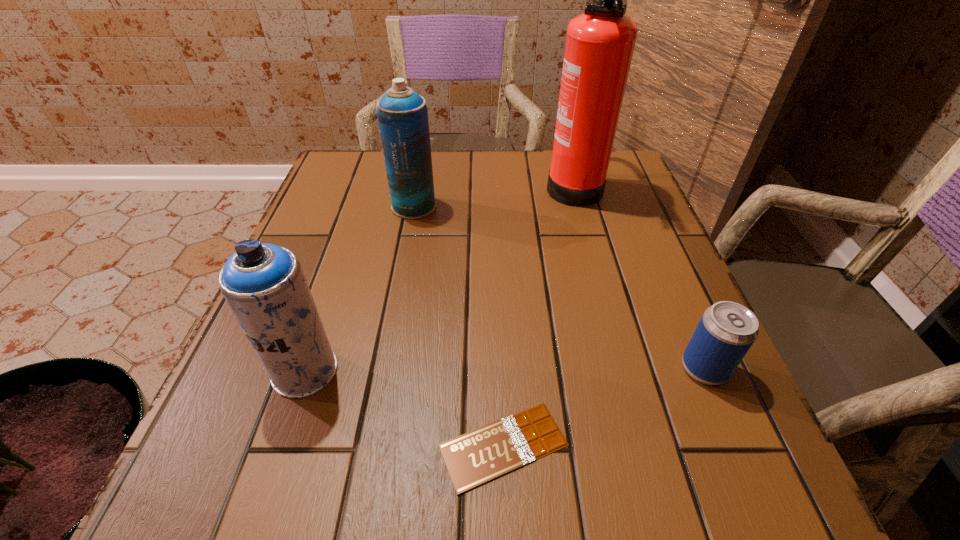
At what (x,y) coordinates should I click in order to perform the action: click on the tallest object. Please return your answer as a coordinate pair (x, y). This screenshot has width=960, height=540. Looking at the image, I should click on (600, 42).

I want to click on fire extinguisher, so click(x=600, y=42).

Locate an element on the screen. This screenshot has height=540, width=960. the farther aerosol can is located at coordinates (402, 114).

Locate an element on the screen. The image size is (960, 540). the right aerosol can is located at coordinates (402, 114).

I want to click on the left aerosol can, so click(x=264, y=284).

Where is `the nearer aerosol can`? the nearer aerosol can is located at coordinates (264, 284).

In order to click on the fourth tallest object in this screenshot , I will do `click(726, 331)`.

What are the coordinates of `the rightmost object` in the screenshot? It's located at (726, 331).

Where is `the shortest object`? the shortest object is located at coordinates coord(472,459).

Where is `the nearest object`? the nearest object is located at coordinates click(472, 459).